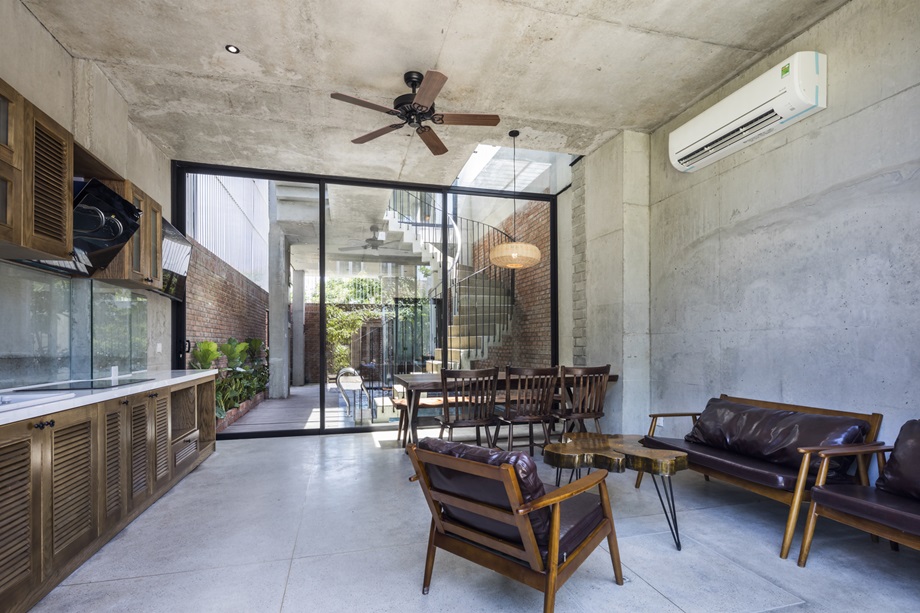
Locate an element on the screen. The image size is (920, 613). ceiling is located at coordinates (187, 36), (512, 51), (242, 139).